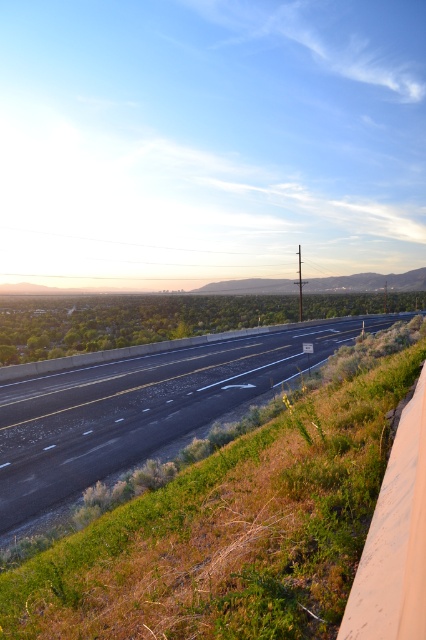
You are standing at the starting point of the highway and want to reach a destination located at point (397, 480). There is an obstacle at point (43, 380) that you must avoid. Which direction should you move to go around the obstacle and head towards your destination?

Since point (43, 380) is closer to you than point (397, 480), you should move around the obstacle by going either to the left or right before proceeding forward towards the destination.

You are driving a car that is 2 meters wide. You need to cross the asphalt road at center while avoiding the green grass at lower right. Is there enough space for your car to pass through the road without touching the grass?

The asphalt road at center is wider than the green grass at lower right, so yes, the car can pass through the asphalt road at center without touching the grass since its width is sufficient for a 2 meter wide car.

You are driving a car that is 5 meters long. You see the asphalt road at center and the green grass at lower right. Which area can your car fit into without overlapping?

The asphalt road at center is bigger than green grass at lower right, so the car can fit into the asphalt road at center without overlapping.